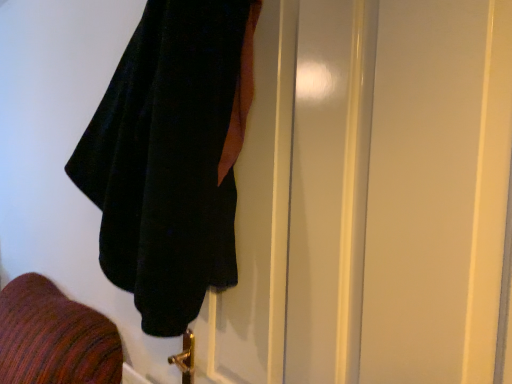
Question: Would you consider velvet black towel at upper left to be distant from velvet black coat at upper left?

Choices:
 (A) no
 (B) yes

Answer: (A)

Question: Is velvet black towel at upper left oriented towards velvet black coat at upper left?

Choices:
 (A) no
 (B) yes

Answer: (A)

Question: Is velvet black towel at upper left shorter than velvet black coat at upper left?

Choices:
 (A) no
 (B) yes

Answer: (B)

Question: Can you confirm if velvet black towel at upper left is smaller than velvet black coat at upper left?

Choices:
 (A) no
 (B) yes

Answer: (A)

Question: From the image's perspective, is velvet black towel at upper left on top of velvet black coat at upper left?

Choices:
 (A) yes
 (B) no

Answer: (A)

Question: Are velvet black towel at upper left and velvet black coat at upper left making contact?

Choices:
 (A) yes
 (B) no

Answer: (B)

Question: Is velvet black coat at upper left shorter than velvet black towel at upper left?

Choices:
 (A) yes
 (B) no

Answer: (B)

Question: Does velvet black coat at upper left have a larger size compared to velvet black towel at upper left?

Choices:
 (A) yes
 (B) no

Answer: (B)

Question: Is velvet black coat at upper left outside of velvet black towel at upper left?

Choices:
 (A) no
 (B) yes

Answer: (A)

Question: Is velvet black coat at upper left positioned far away from velvet black towel at upper left?

Choices:
 (A) yes
 (B) no

Answer: (B)

Question: Is velvet black coat at upper left at the right side of velvet black towel at upper left?

Choices:
 (A) no
 (B) yes

Answer: (B)

Question: Can you confirm if velvet black coat at upper left is taller than velvet black towel at upper left?

Choices:
 (A) no
 (B) yes

Answer: (B)

Question: From the image's perspective, is velvet black towel at upper left above or below velvet black coat at upper left?

Choices:
 (A) below
 (B) above

Answer: (B)